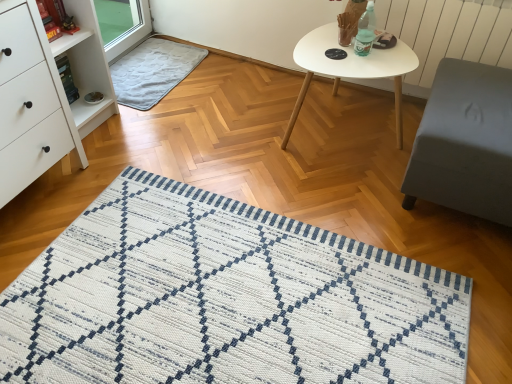
The width and height of the screenshot is (512, 384). I want to click on free spot to the right of white matte chest of drawers at left, so click(111, 173).